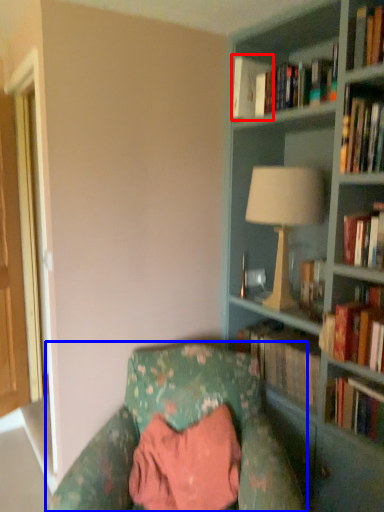
Question: Which point is closer to the camera, book (highlighted by a red box) or chair (highlighted by a blue box)?

Choices:
 (A) book
 (B) chair

Answer: (B)